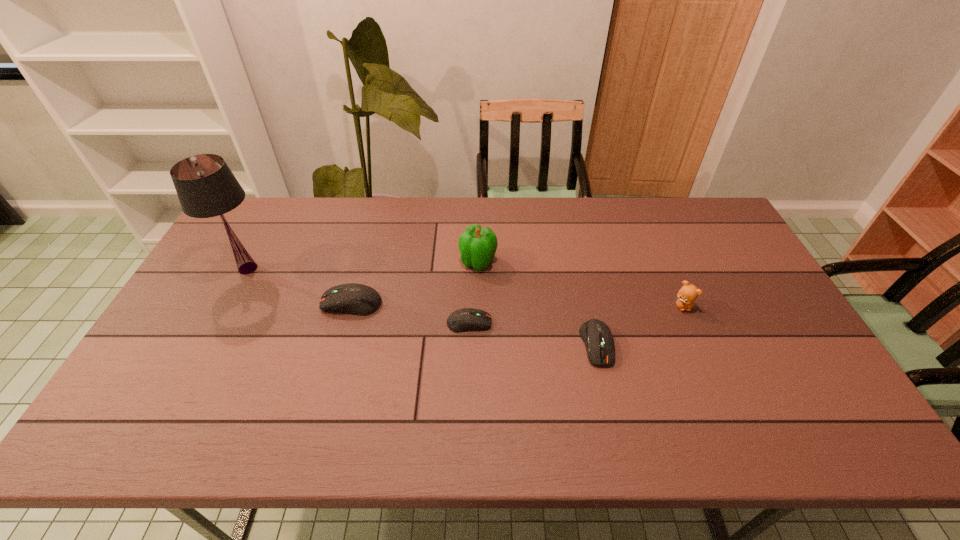
Considering the uniform spacing of computer equipments, where should an additional computer equipment be positioned on the right? Please locate a free spot. Please provide its 2D coordinates. Your answer should be formatted as a tuple, i.e. [(x, y)], where the tuple contains the x and y coordinates of a point satisfying the conditions above.

[(736, 368)]